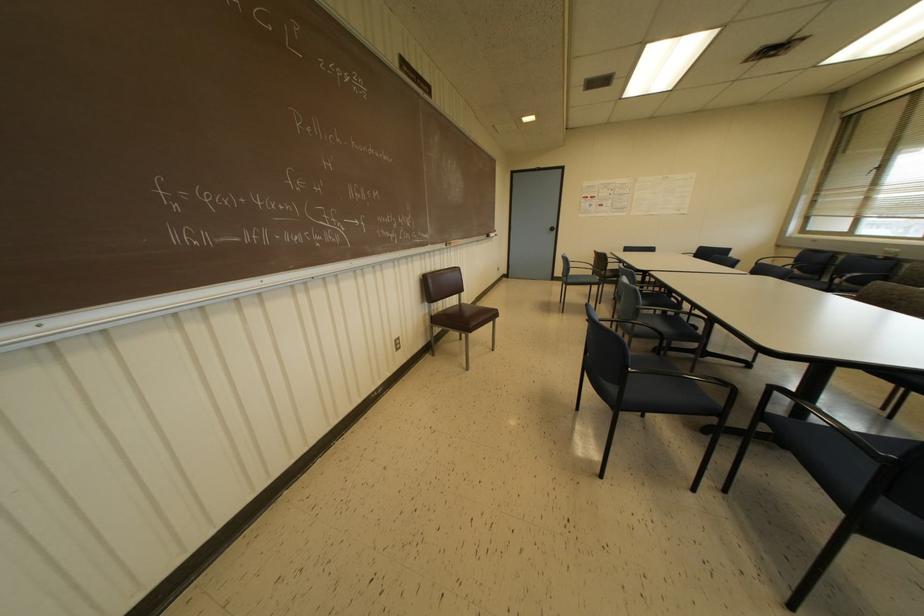
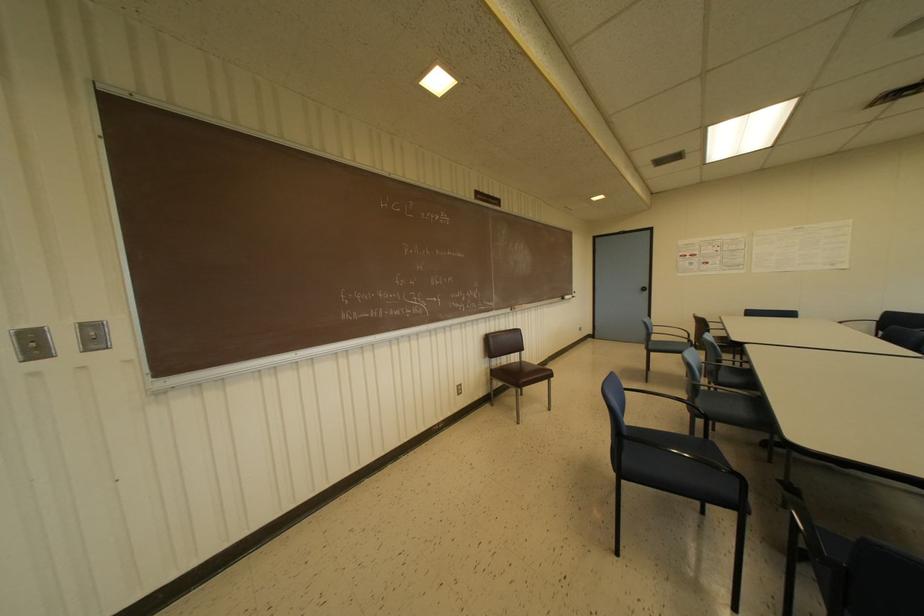
The point at (x=453, y=243) is marked in the first image. Where is the corresponding point in the second image?

(517, 307)